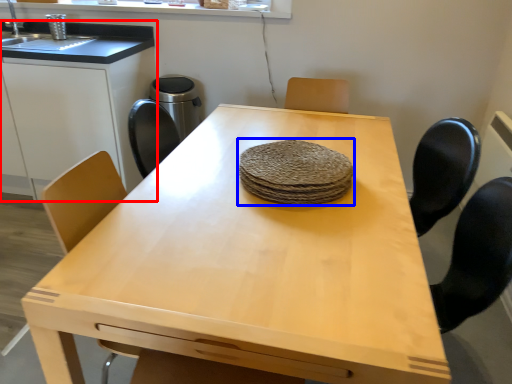
Question: Which of the following is the farthest to the observer, cabinetry (highlighted by a red box) or food (highlighted by a blue box)?

Choices:
 (A) cabinetry
 (B) food

Answer: (A)